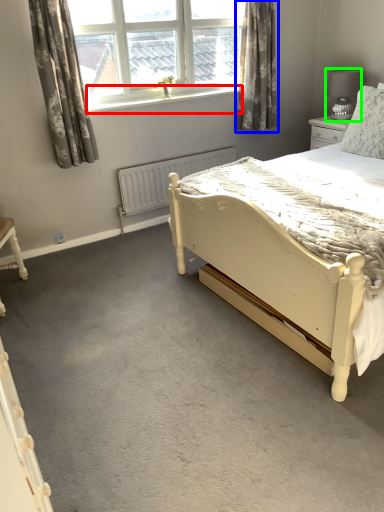
Question: Which object is the closest to the window sill (highlighted by a red box)? Choose among these: curtain (highlighted by a blue box) or lamp (highlighted by a green box).

Choices:
 (A) curtain
 (B) lamp

Answer: (A)